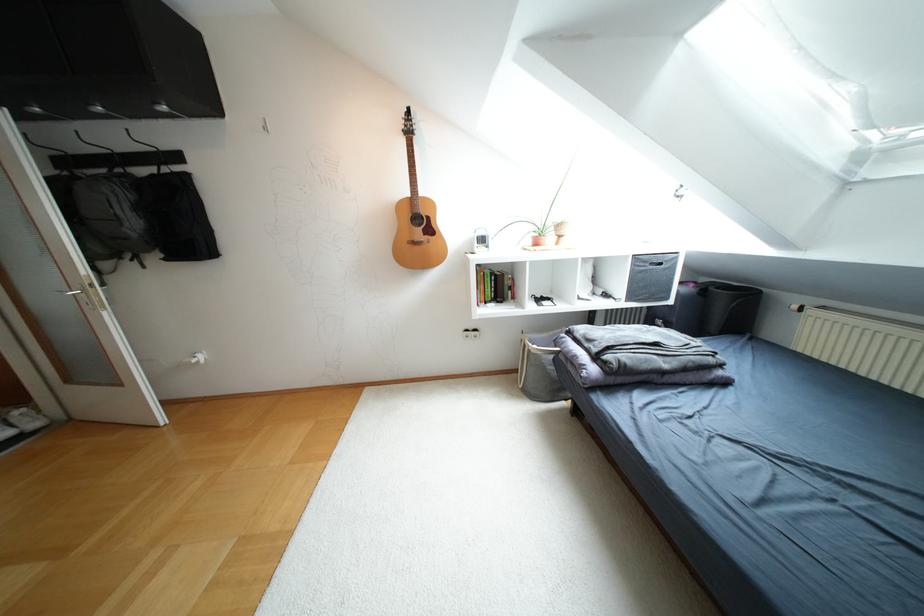
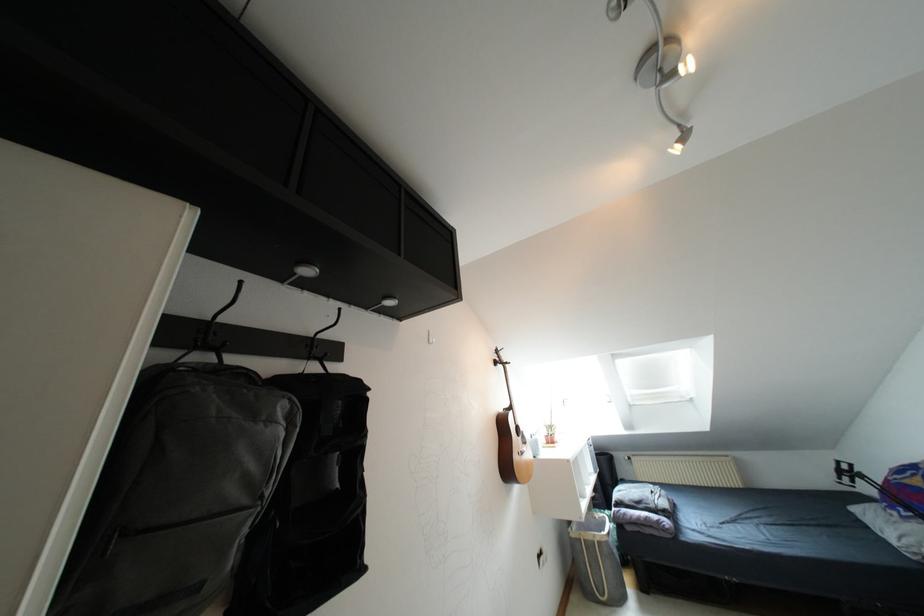
Question: I am providing you with two images of the same scene from different viewpoints. Please identify which objects are invisible in image2.

Choices:
 (A) purple lidded container
 (B) silver spotlight head
 (C) grey laundry hamper
 (D) acoustic guitar

Answer: (D)